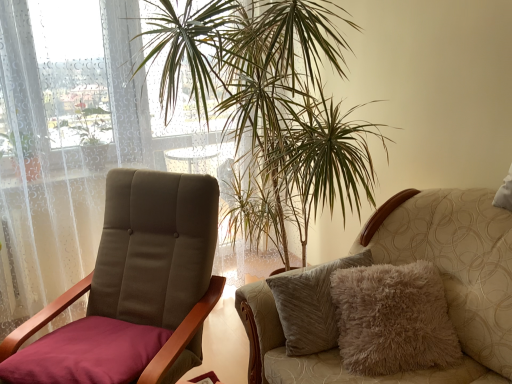
Question: Can you confirm if velvet maroon chair at left, which appears as the first chair when viewed from the left, is shorter than fuzzy beige cushion at right, the second chair from the left?

Choices:
 (A) yes
 (B) no

Answer: (B)

Question: Is velvet maroon chair at left, which appears as the first chair when viewed from the left, placed right next to fuzzy beige cushion at right, which appears as the 1th chair when viewed from the right?

Choices:
 (A) yes
 (B) no

Answer: (B)

Question: From a real-world perspective, is velvet maroon chair at left, which appears as the first chair when viewed from the left, beneath fuzzy beige cushion at right, which appears as the 1th chair when viewed from the right?

Choices:
 (A) no
 (B) yes

Answer: (A)

Question: From a real-world perspective, is velvet maroon chair at left, which appears as the first chair when viewed from the left, positioned over fuzzy beige cushion at right, which appears as the 1th chair when viewed from the right, based on gravity?

Choices:
 (A) yes
 (B) no

Answer: (A)

Question: Is velvet maroon chair at left, which appears as the first chair when viewed from the left, at the left side of fuzzy beige cushion at right, which appears as the 1th chair when viewed from the right?

Choices:
 (A) no
 (B) yes

Answer: (B)

Question: Relative to green leafy plant at center, is fuzzy beige cushion at right, which appears as the 1th chair when viewed from the right, in front or behind?

Choices:
 (A) front
 (B) behind

Answer: (A)

Question: In terms of height, does fuzzy beige cushion at right, which appears as the 1th chair when viewed from the right, look taller or shorter compared to green leafy plant at center?

Choices:
 (A) short
 (B) tall

Answer: (A)

Question: Considering the positions of fuzzy beige cushion at right, which appears as the 1th chair when viewed from the right, and green leafy plant at center in the image, is fuzzy beige cushion at right, which appears as the 1th chair when viewed from the right, bigger or smaller than green leafy plant at center?

Choices:
 (A) big
 (B) small

Answer: (B)

Question: From the image's perspective, is fuzzy beige cushion at right, the second chair from the left, located above or below green leafy plant at center?

Choices:
 (A) below
 (B) above

Answer: (A)

Question: From the image's perspective, is velvet maroon chair at left, the 2th chair viewed from the right, located above or below green leafy plant at center?

Choices:
 (A) below
 (B) above

Answer: (A)

Question: From a real-world perspective, relative to green leafy plant at center, is velvet maroon chair at left, the 2th chair viewed from the right, vertically above or below?

Choices:
 (A) below
 (B) above

Answer: (A)

Question: Is velvet maroon chair at left, the 2th chair viewed from the right, inside or outside of green leafy plant at center?

Choices:
 (A) outside
 (B) inside

Answer: (A)

Question: Based on their sizes in the image, would you say velvet maroon chair at left, which appears as the first chair when viewed from the left, is bigger or smaller than green leafy plant at center?

Choices:
 (A) small
 (B) big

Answer: (A)

Question: Looking at their shapes, would you say fuzzy beige cushion at right, which appears as the 1th chair when viewed from the right, is wider or thinner than velvet maroon chair at left, which appears as the first chair when viewed from the left?

Choices:
 (A) thin
 (B) wide

Answer: (B)

Question: In terms of height, does fuzzy beige cushion at right, the second chair from the left, look taller or shorter compared to velvet maroon chair at left, the 2th chair viewed from the right?

Choices:
 (A) short
 (B) tall

Answer: (A)